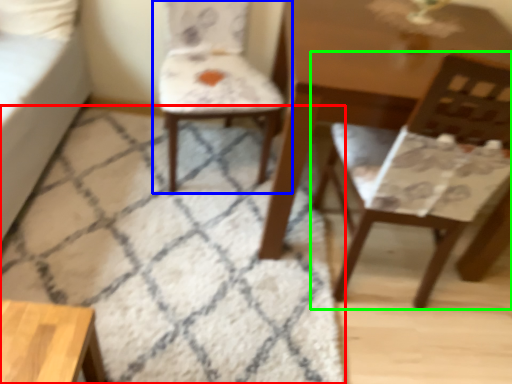
Question: Estimate the real-world distances between objects in this image. Which object is closer to mat (highlighted by a red box), chair (highlighted by a blue box) or chair (highlighted by a green box)?

Choices:
 (A) chair
 (B) chair

Answer: (A)